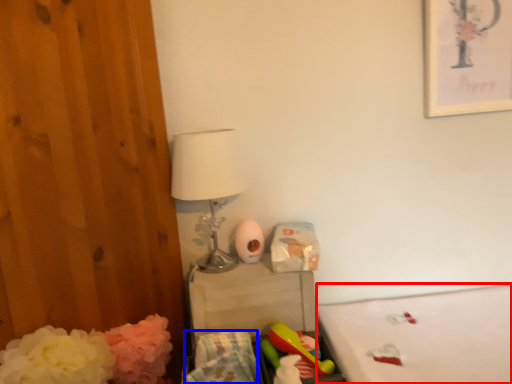
Question: Among these objects, which one is farthest to the camera, mattress (highlighted by a red box) or material (highlighted by a blue box)?

Choices:
 (A) mattress
 (B) material

Answer: (A)